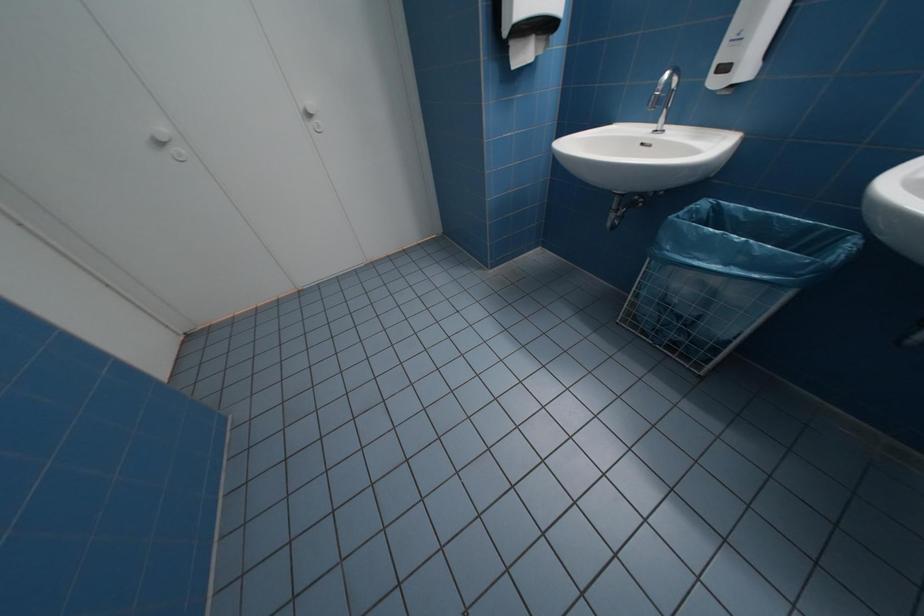
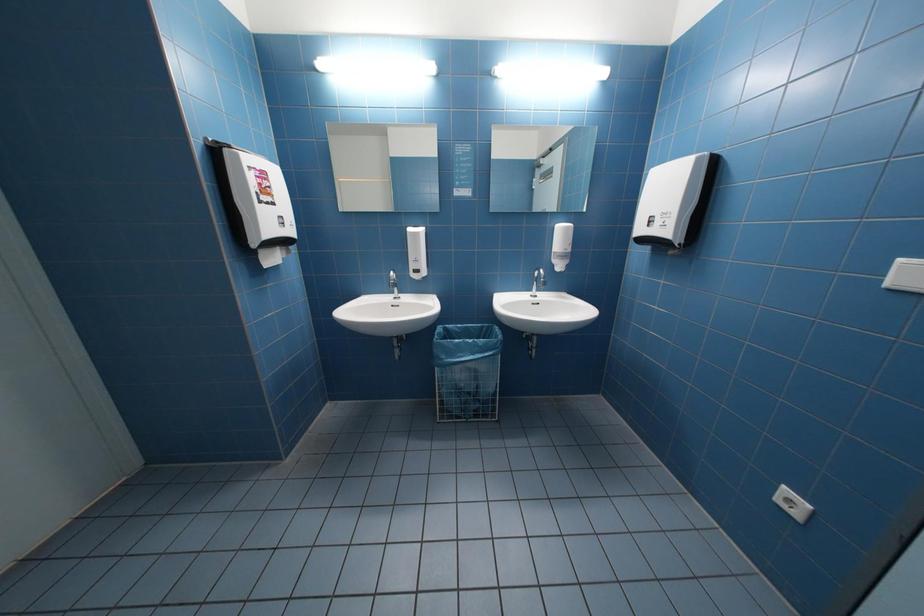
Question: The camera is either moving clockwise (left) or counter-clockwise (right) around the object. The first image is from the beginning of the video and the second image is from the end. Is the camera moving left or right when shooting the video?

Choices:
 (A) Left
 (B) Right

Answer: (A)